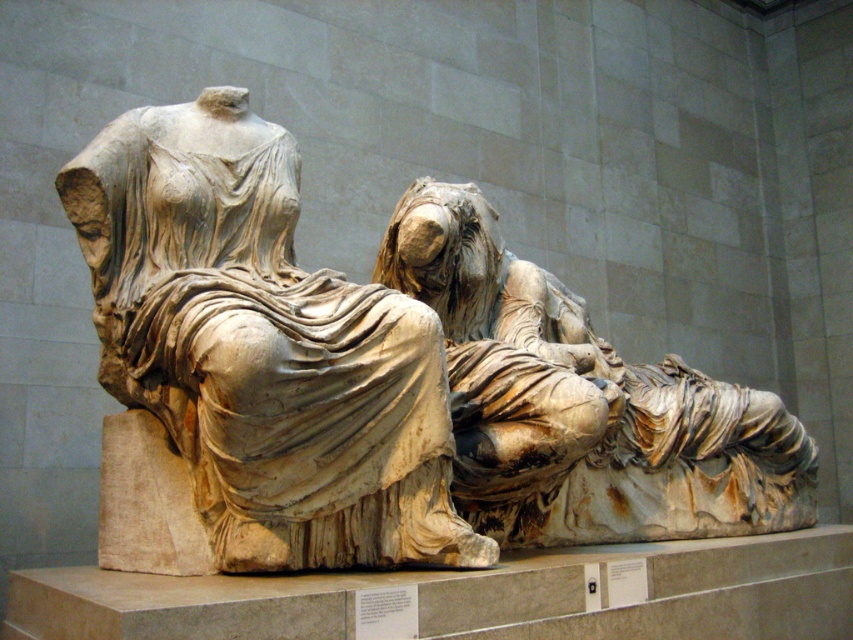
You are standing in a museum and want to take a photo of the white marble statue at left. If you need to be within 15 meters to get a clear shot, can you capture it from your current position?

The white marble statue at left is 16.61 meters away from the viewer. Since the required distance for a clear shot is within 15 meters, you cannot capture it from your current position and need to move closer.

You are standing in front of a classical marble sculpture depicting two figures. There is a specific point at coordinates point [172,216] that you want to examine closely. Considering your current position, can you reach this point without moving closer to the sculpture?

The point [172,216] is 64.66 feet away from the camera, so you cannot reach it without moving closer to the sculpture.

You are an art conservator examining the sculpture. You notice two points on the sculpture marked at coordinates point (277, 524) and point (479, 321). Which point is nearer to your line of sight?

Point (277, 524) is closer to the viewer than point (479, 321).